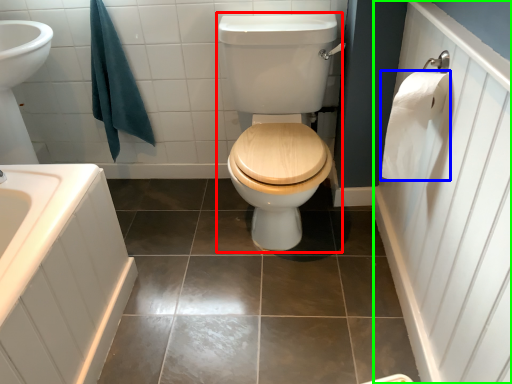
Question: Which object is the farthest from sit (highlighted by a red box)? Choose among these: toilet paper (highlighted by a blue box) or side (highlighted by a green box).

Choices:
 (A) toilet paper
 (B) side

Answer: (B)